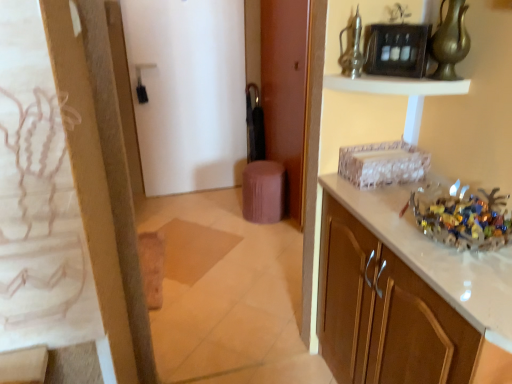
Where is `translucent glass bowl at right`? translucent glass bowl at right is located at coordinates (465, 220).

At what (x,y) coordinates should I click in order to perform the action: click on brown matte door at center, acting as the 1th door starting from the right. Please return your answer as a coordinate pair (x, y). This screenshot has height=384, width=512. Looking at the image, I should click on (285, 91).

The height and width of the screenshot is (384, 512). I want to click on translucent glass bowl at right, so click(x=465, y=220).

From the image's perspective, is white glossy shelf at upper center positioned above or below purple fabric stool at center?

Clearly, from the image's perspective, white glossy shelf at upper center is above purple fabric stool at center.

Is white glossy shelf at upper center shorter than purple fabric stool at center?

Yes.

The width and height of the screenshot is (512, 384). I want to click on shelf lying in front of the purple fabric stool at center, so click(396, 85).

From the picture: From their relative heights in the image, would you say metallic glass vase at upper center, the 2th glass vase from the right, is taller or shorter than white glossy cabinet at right?

In the image, metallic glass vase at upper center, the 2th glass vase from the right, appears to be shorter than white glossy cabinet at right.

Based on their sizes in the image, would you say metallic glass vase at upper center, the 2th glass vase from the right, is bigger or smaller than white glossy cabinet at right?

Considering their sizes, metallic glass vase at upper center, the 2th glass vase from the right, takes up less space than white glossy cabinet at right.

Is metallic glass vase at upper center, which appears as the first glass vase when viewed from the left, with white glossy cabinet at right?

metallic glass vase at upper center, which appears as the first glass vase when viewed from the left, is not next to white glossy cabinet at right, and they're not touching.

Is gold metallic vase at upper right, the 1th glass vase viewed from the right, positioned far away from translucent glass bowl at right?

No, gold metallic vase at upper right, the 1th glass vase viewed from the right, is in close proximity to translucent glass bowl at right.

Which is less distant, [449,72] or [490,210]?

Clearly, point [449,72] is more distant from the camera than point [490,210].

Considering the sizes of gold metallic vase at upper right, the 1th glass vase viewed from the right, and translucent glass bowl at right in the image, is gold metallic vase at upper right, the 1th glass vase viewed from the right, wider or thinner than translucent glass bowl at right?

In the image, gold metallic vase at upper right, the 1th glass vase viewed from the right, appears to be more narrow than translucent glass bowl at right.

Is gold metallic vase at upper right, the 1th glass vase viewed from the right, to the right of translucent glass bowl at right from the viewer's perspective?

Yes.

From the image's perspective, is white glossy cabinet at right located above gold metallic vase at upper right, acting as the 2th glass vase starting from the left?

Actually, white glossy cabinet at right appears below gold metallic vase at upper right, acting as the 2th glass vase starting from the left, in the image.

This screenshot has height=384, width=512. In order to click on cabinetry on the left of gold metallic vase at upper right, the 1th glass vase viewed from the right in this screenshot , I will do `click(385, 313)`.

Who is taller, white glossy cabinet at right or gold metallic vase at upper right, acting as the 2th glass vase starting from the left?

white glossy cabinet at right.

Is white glossy cabinet at right aimed at gold metallic vase at upper right, acting as the 2th glass vase starting from the left?

No, white glossy cabinet at right does not turn towards gold metallic vase at upper right, acting as the 2th glass vase starting from the left.

Does metallic glass vase at upper center, the 2th glass vase from the right, appear on the right side of translucent glass bowl at right?

No.

Based on their sizes in the image, would you say metallic glass vase at upper center, which appears as the first glass vase when viewed from the left, is bigger or smaller than translucent glass bowl at right?

Clearly, metallic glass vase at upper center, which appears as the first glass vase when viewed from the left, is smaller in size than translucent glass bowl at right.

From the image's perspective, which is below, metallic glass vase at upper center, the 2th glass vase from the right, or translucent glass bowl at right?

From the image's view, translucent glass bowl at right is below.

Is metallic glass vase at upper center, the 2th glass vase from the right, far away from translucent glass bowl at right?

No, metallic glass vase at upper center, the 2th glass vase from the right, is not far away from translucent glass bowl at right.

In terms of width, does brown matte door at center, the second door positioned from the left, look wider or thinner when compared to translucent glass bowl at right?

brown matte door at center, the second door positioned from the left, is thinner than translucent glass bowl at right.

Which object is closer to the camera taking this photo, brown matte door at center, acting as the 1th door starting from the right, or translucent glass bowl at right?

translucent glass bowl at right is closer to the camera.

What's the angular difference between brown matte door at center, the second door positioned from the left, and translucent glass bowl at right's facing directions?

There is a 0.552-degree angle between the facing directions of brown matte door at center, the second door positioned from the left, and translucent glass bowl at right.

Can we say brown matte door at center, the second door positioned from the left, lies outside translucent glass bowl at right?

brown matte door at center, the second door positioned from the left, is positioned outside translucent glass bowl at right.

Can you tell me how much brown matte door at center, the second door positioned from the left, and gold metallic vase at upper right, the 1th glass vase viewed from the right, differ in facing direction?

89.2 degrees.

Between brown matte door at center, the second door positioned from the left, and gold metallic vase at upper right, the 1th glass vase viewed from the right, which one has less height?

gold metallic vase at upper right, the 1th glass vase viewed from the right.

Is point (274, 51) less distant than point (454, 5)?

That is False.

At what (x,y) coordinates should I click in order to perform the action: click on shelf on the right of purple fabric stool at center. Please return your answer as a coordinate pair (x, y). Looking at the image, I should click on (396, 85).

From the image's perspective, count 1st glass vases upward from the white glossy cabinet at right and point to it. Please provide its 2D coordinates.

[(352, 49)]

From the image, which object appears to be farther from gold metallic vase at upper right, the 1th glass vase viewed from the right, purple fabric stool at center or white glossy shelf at upper center?

Based on the image, purple fabric stool at center appears to be further to gold metallic vase at upper right, the 1th glass vase viewed from the right.

Based on their spatial positions, is white glossy cabinet at right or purple fabric stool at center closer to gold metallic vase at upper right, the 1th glass vase viewed from the right?

The object closer to gold metallic vase at upper right, the 1th glass vase viewed from the right, is white glossy cabinet at right.

Considering their positions, is white glossy cabinet at right positioned closer to gold metallic vase at upper right, the 1th glass vase viewed from the right, than metallic glass vase at upper center, the 2th glass vase from the right?

metallic glass vase at upper center, the 2th glass vase from the right, is closer to gold metallic vase at upper right, the 1th glass vase viewed from the right.

From the image, which object appears to be farther from gold metallic vase at upper right, acting as the 2th glass vase starting from the left, white matte door at center, the 2th door viewed from the right, or white glossy shelf at upper center?

white matte door at center, the 2th door viewed from the right, lies further to gold metallic vase at upper right, acting as the 2th glass vase starting from the left, than the other object.

Estimate the real-world distances between objects in this image. Which object is closer to translucent glass bowl at right, purple fabric stool at center or metallic glass vase at upper center, which appears as the first glass vase when viewed from the left?

metallic glass vase at upper center, which appears as the first glass vase when viewed from the left, lies closer to translucent glass bowl at right than the other object.

From the picture: From the image, which object appears to be farther from gold metallic vase at upper right, acting as the 2th glass vase starting from the left, translucent glass bowl at right or metallic glass vase at upper center, which appears as the first glass vase when viewed from the left?

translucent glass bowl at right is further to gold metallic vase at upper right, acting as the 2th glass vase starting from the left.

Estimate the real-world distances between objects in this image. Which object is closer to purple fabric stool at center, white glossy cabinet at right or metallic glass vase at upper center, which appears as the first glass vase when viewed from the left?

white glossy cabinet at right is closer to purple fabric stool at center.

Looking at the image, which one is located closer to purple fabric stool at center, metallic glass vase at upper center, which appears as the first glass vase when viewed from the left, or white glossy shelf at upper center?

white glossy shelf at upper center is positioned closer to the anchor purple fabric stool at center.

Locate an element on the screen. The height and width of the screenshot is (384, 512). glass vase between gold metallic vase at upper right, acting as the 2th glass vase starting from the left, and white glossy cabinet at right, in the vertical direction is located at coordinates (352, 49).

Locate an element on the screen. shelf between translucent glass bowl at right and purple fabric stool at center from front to back is located at coordinates (396, 85).

Identify the location of stool located between white glossy cabinet at right and white matte door at center, the 1th door viewed from the left, in the depth direction. (263, 191).

Identify the location of door between white glossy cabinet at right and purple fabric stool at center along the z-axis. (285, 91).